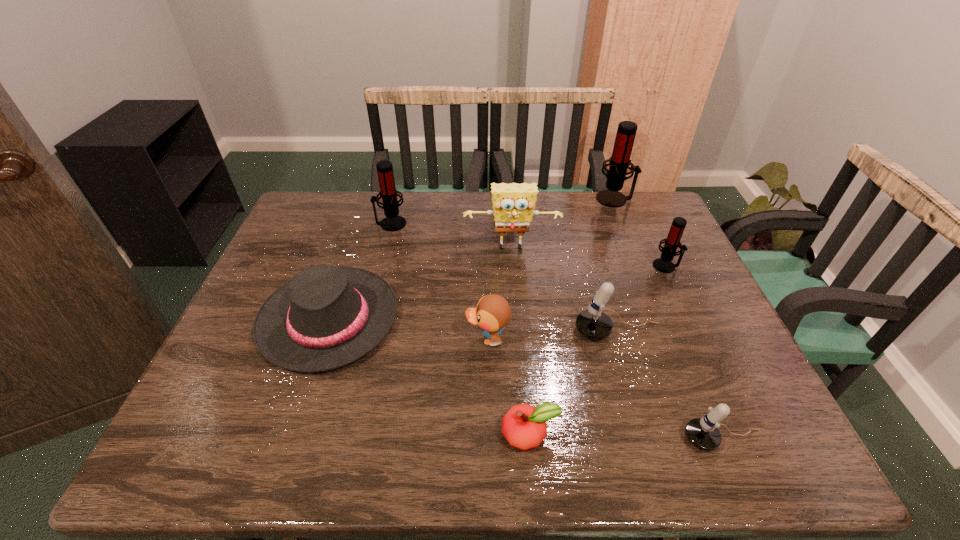
Find the location of a particular element. The height and width of the screenshot is (540, 960). the closest microphone to the farther white microphone is located at coordinates (663, 264).

Select which microphone appears as the closest to the blue duck. Please provide its 2D coordinates. Your answer should be formatted as a tuple, i.e. [(x, y)], where the tuple contains the x and y coordinates of a point satisfying the conditions above.

[(594, 324)]

Find the location of a particular element. The width and height of the screenshot is (960, 540). red microphone that is the closest to the duck is located at coordinates (388, 193).

Where is `the second closest red microphone to the shortest object`? The image size is (960, 540). the second closest red microphone to the shortest object is located at coordinates (388, 193).

I want to click on blank area in the image that satisfies the following two spatial constraints: 1. on the front side of the fourth farthest object; 2. on the front-facing side of the duck, so click(x=700, y=339).

The height and width of the screenshot is (540, 960). In order to click on free region that satisfies the following two spatial constraints: 1. on the face of the apple; 2. on the right side of the sponge in this screenshot , I will do (526, 434).